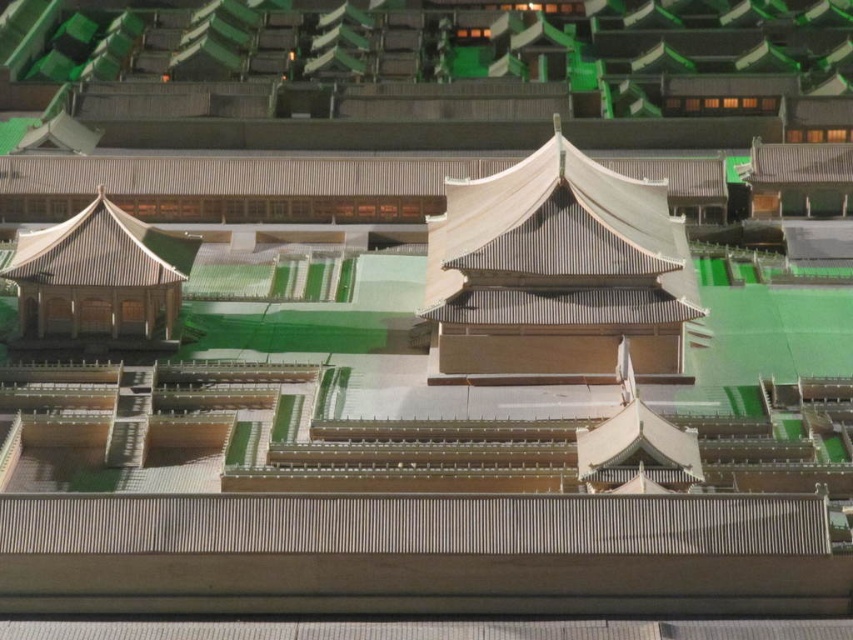
You are an architect examining the palace model. You notice the matte gray roof at center and the matte brown gazebo at left. Which object is positioned higher in elevation?

The matte gray roof at center is located above the matte brown gazebo at left, so it is positioned higher in elevation.

You are an architect examining the palace model. You notice the matte gray roof at center and the matte brown gazebo at left. Which structure is positioned closer to your viewpoint?

The matte gray roof at center is closer to the viewer than the matte brown gazebo at left.